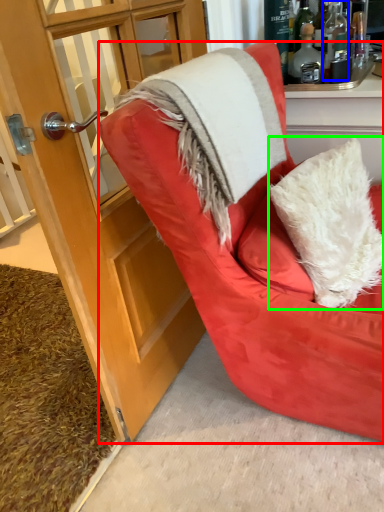
Question: Considering the real-world distances, which object is farthest from chair (highlighted by a red box)? bottle (highlighted by a blue box) or pillow (highlighted by a green box)?

Choices:
 (A) bottle
 (B) pillow

Answer: (A)